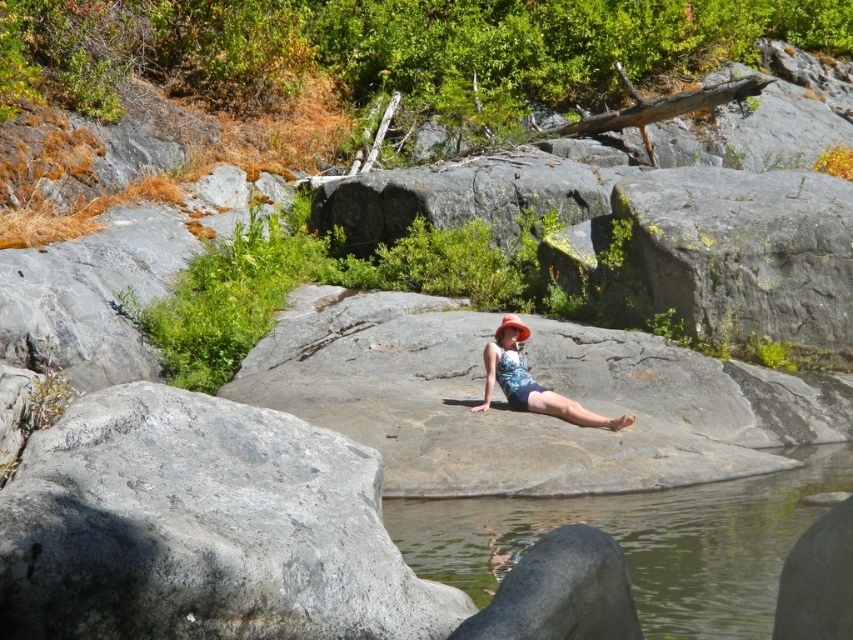
Is gray rough rock at center thinner than clear water at center?

Yes, gray rough rock at center is thinner than clear water at center.

How far apart are gray rough rock at center and clear water at center?

gray rough rock at center is 6.77 meters from clear water at center.

Is point (364, 516) less distant than point (799, 496)?

Yes.

The height and width of the screenshot is (640, 853). I want to click on gray rough rock at center, so click(x=202, y=529).

The width and height of the screenshot is (853, 640). Describe the element at coordinates (642, 541) in the screenshot. I see `clear water at center` at that location.

Is clear water at center above orange fabric hat at center?

Actually, clear water at center is below orange fabric hat at center.

Is point (747, 557) in front of point (515, 317)?

Yes, point (747, 557) is closer to viewer.

Locate an element on the screen. clear water at center is located at coordinates (642, 541).

Does clear water at center appear on the right side of matte floral swimsuit at center?

Yes, clear water at center is to the right of matte floral swimsuit at center.

Which is more to the right, clear water at center or matte floral swimsuit at center?

Positioned to the right is clear water at center.

Does point (758, 483) come farther from viewer compared to point (517, 355)?

No, it is in front of (517, 355).

Locate an element on the screen. clear water at center is located at coordinates (642, 541).